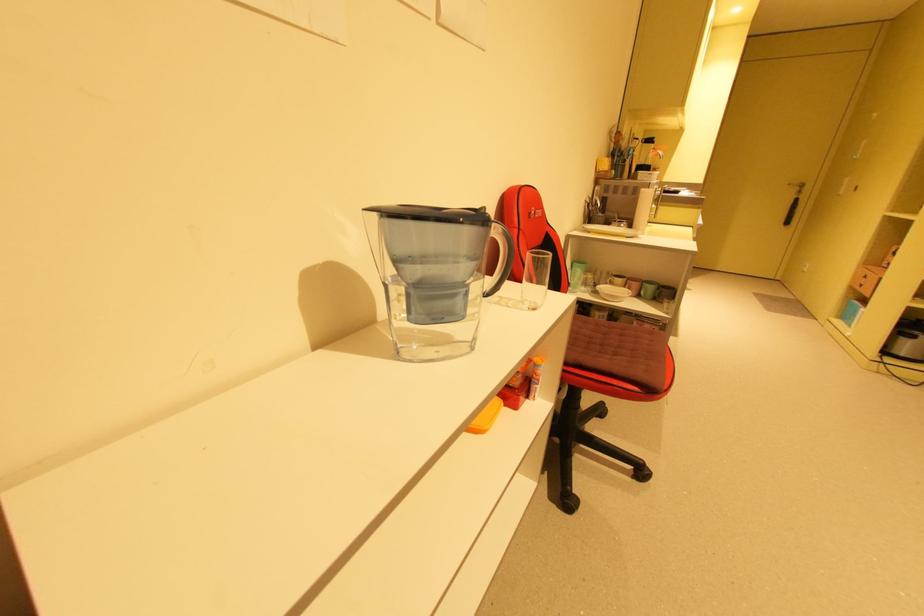
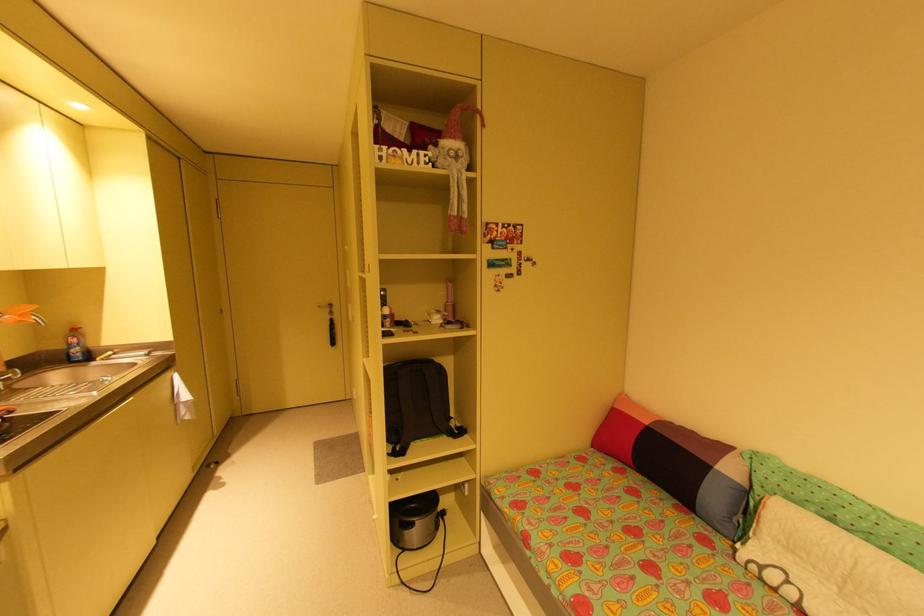
The point at (801, 188) is marked in the first image. Where is the corresponding point in the second image?

(333, 310)